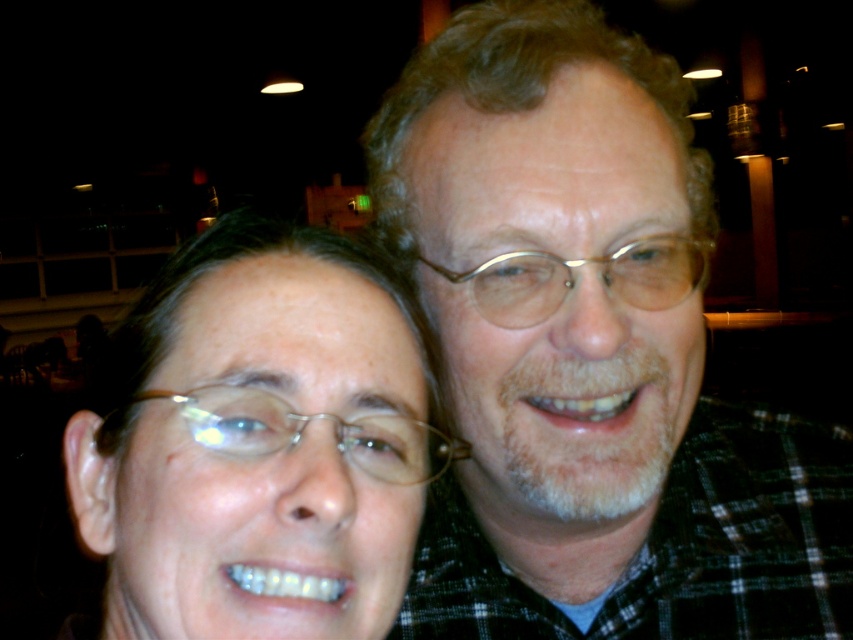
Question: Which object is the closest to the metallic silver glasses at center?

Choices:
 (A) metallic gold glasses at center
 (B) plaid shirt at center

Answer: (A)

Question: Can you confirm if metallic silver glasses at center is bigger than metallic gold glasses at center?

Choices:
 (A) yes
 (B) no

Answer: (B)

Question: Does matte gold glasses at center appear over metallic gold glasses at center?

Choices:
 (A) no
 (B) yes

Answer: (A)

Question: Which object is closer to the camera taking this photo?

Choices:
 (A) matte gold glasses at center
 (B) metallic silver glasses at center
 (C) plaid shirt at center

Answer: (A)

Question: Does plaid shirt at center have a larger size compared to metallic silver glasses at center?

Choices:
 (A) yes
 (B) no

Answer: (A)

Question: Which object is the closest to the metallic silver glasses at center?

Choices:
 (A) plaid shirt at center
 (B) matte gold glasses at center

Answer: (B)